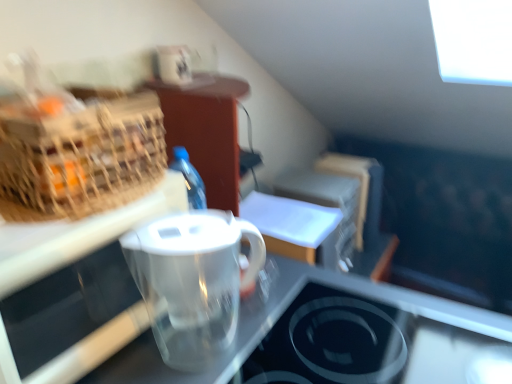
Question: Is transparent glass stovetop at lower center bigger than transparent plastic pitcher at center?

Choices:
 (A) no
 (B) yes

Answer: (A)

Question: Considering the relative sizes of transparent glass stovetop at lower center and transparent plastic pitcher at center in the image provided, is transparent glass stovetop at lower center shorter than transparent plastic pitcher at center?

Choices:
 (A) yes
 (B) no

Answer: (A)

Question: Is the depth of transparent glass stovetop at lower center less than that of transparent plastic pitcher at center?

Choices:
 (A) yes
 (B) no

Answer: (B)

Question: Is transparent glass stovetop at lower center further to camera compared to transparent plastic pitcher at center?

Choices:
 (A) yes
 (B) no

Answer: (A)

Question: From the image's perspective, is transparent glass stovetop at lower center on top of transparent plastic pitcher at center?

Choices:
 (A) yes
 (B) no

Answer: (A)

Question: Is there a large distance between transparent glass stovetop at lower center and transparent plastic pitcher at center?

Choices:
 (A) no
 (B) yes

Answer: (A)

Question: Can you confirm if transparent plastic pitcher at center is bigger than transparent plastic pitcher at center?

Choices:
 (A) yes
 (B) no

Answer: (B)

Question: Is transparent plastic pitcher at center positioned behind transparent plastic pitcher at center?

Choices:
 (A) no
 (B) yes

Answer: (B)

Question: Is transparent plastic pitcher at center facing towards transparent plastic pitcher at center?

Choices:
 (A) yes
 (B) no

Answer: (B)

Question: From the image's perspective, is transparent plastic pitcher at center under transparent plastic pitcher at center?

Choices:
 (A) no
 (B) yes

Answer: (A)

Question: Does transparent plastic pitcher at center have a greater width compared to transparent plastic pitcher at center?

Choices:
 (A) yes
 (B) no

Answer: (B)

Question: Are transparent plastic pitcher at center and transparent plastic pitcher at center far apart?

Choices:
 (A) yes
 (B) no

Answer: (B)

Question: Is woven straw picnic basket at left in contact with transparent plastic pitcher at center?

Choices:
 (A) no
 (B) yes

Answer: (A)